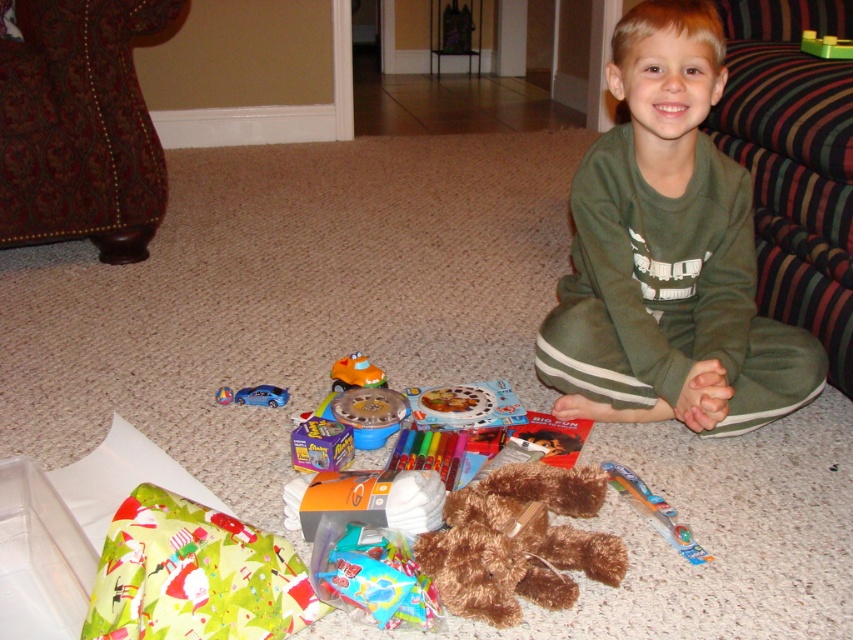
Who is positioned more to the right, green cotton sweatshirt at center or metallic blue car at lower left?

Positioned to the right is green cotton sweatshirt at center.

Is green cotton sweatshirt at center thinner than metallic blue car at lower left?

In fact, green cotton sweatshirt at center might be wider than metallic blue car at lower left.

Locate an element on the screen. The width and height of the screenshot is (853, 640). green cotton sweatshirt at center is located at coordinates (668, 253).

Is brown plush teddy bear at lower center closer to camera compared to translucent plastic candy at center?

No, it is not.

Locate an element on the screen. The width and height of the screenshot is (853, 640). brown plush teddy bear at lower center is located at coordinates (518, 541).

You are a GUI agent. You are given a task and a screenshot of the screen. Output one action in this format:
    pyautogui.click(x=<x>, y=<y>)
    Task: Click on the brown plush teddy bear at lower center
    This screenshot has height=640, width=853.
    Given the screenshot: What is the action you would take?
    pyautogui.click(x=518, y=541)

Who is more forward, (x=103, y=241) or (x=332, y=369)?

Point (x=332, y=369)

Does brown fabric armchair at left have a smaller size compared to orange plastic toy car at center?

Incorrect, brown fabric armchair at left is not smaller in size than orange plastic toy car at center.

What do you see at coordinates (79, 124) in the screenshot? I see `brown fabric armchair at left` at bounding box center [79, 124].

What are the coordinates of `brown fabric armchair at left` in the screenshot? It's located at (79, 124).